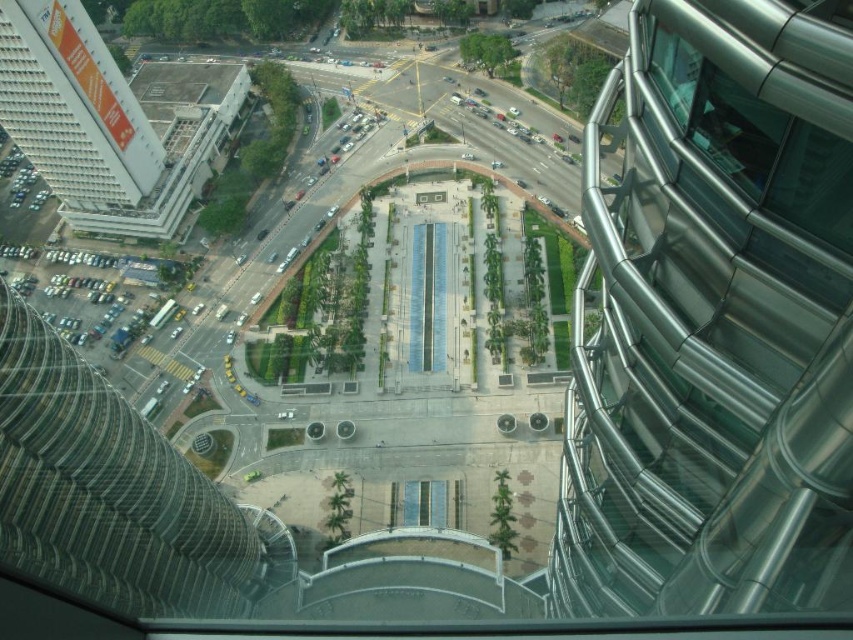
Question: Which point is closer to the camera taking this photo?

Choices:
 (A) (76, 104)
 (B) (802, 256)

Answer: (B)

Question: Does metallic silver tower at right lie in front of white textured building at upper left?

Choices:
 (A) yes
 (B) no

Answer: (A)

Question: Which point is closer to the camera?

Choices:
 (A) white textured building at upper left
 (B) metallic silver tower at right

Answer: (B)

Question: Among these points, which one is nearest to the camera?

Choices:
 (A) (20, 51)
 (B) (773, 413)

Answer: (B)

Question: Can you confirm if metallic silver tower at right is smaller than white textured building at upper left?

Choices:
 (A) no
 (B) yes

Answer: (B)

Question: Does metallic silver tower at right have a lesser width compared to white textured building at upper left?

Choices:
 (A) yes
 (B) no

Answer: (A)